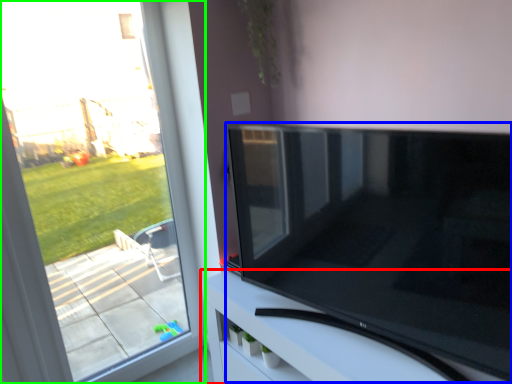
Question: Based on their relative distances, which object is farther from furniture (highlighted by a red box)? Choose from television (highlighted by a blue box) and window (highlighted by a green box).

Choices:
 (A) television
 (B) window

Answer: (B)